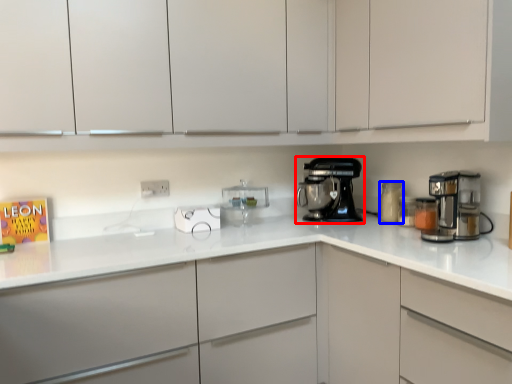
Question: Which object is further to the camera taking this photo, home appliance (highlighted by a red box) or kitchen appliance (highlighted by a blue box)?

Choices:
 (A) home appliance
 (B) kitchen appliance

Answer: (A)